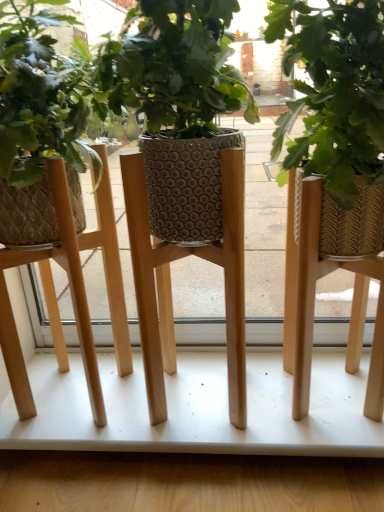
The image size is (384, 512). I want to click on free space above wooden table at center (from a real-world perspective), so click(x=190, y=395).